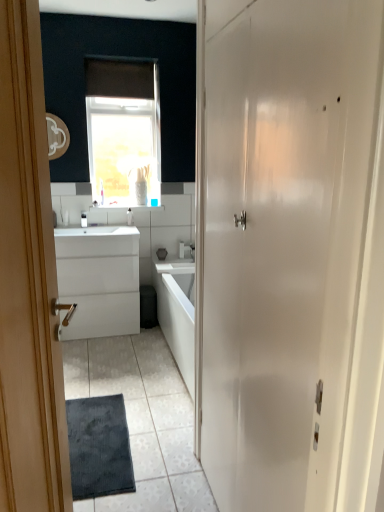
Image resolution: width=384 pixels, height=512 pixels. I want to click on vacant area on top of dark gray textured bath mat at lower center (from a real-world perspective), so point(107,438).